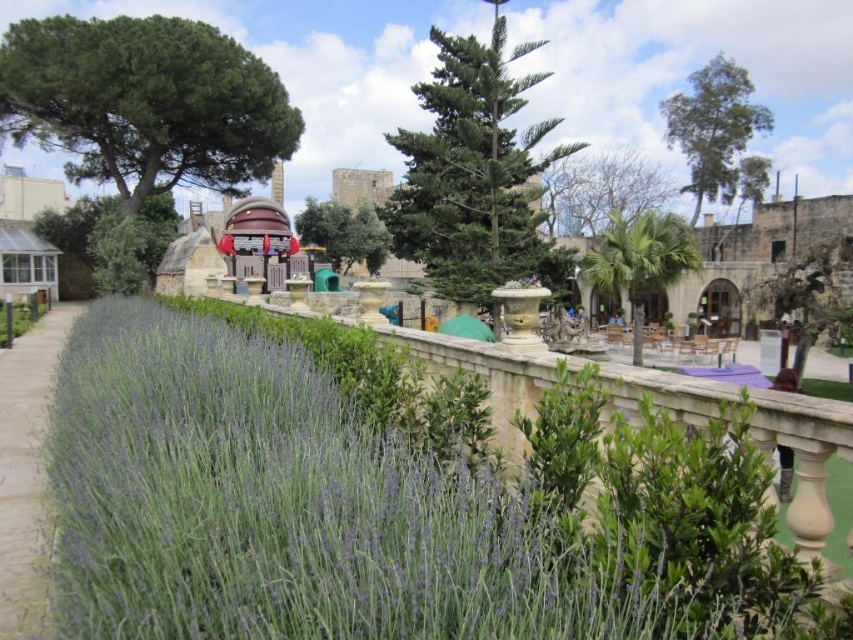
Question: Which of these objects is positioned farthest from the green leafy lavender at lower left?

Choices:
 (A) green leafy palm at center
 (B) green leafy tree at upper right
 (C) green textured tree at center

Answer: (B)

Question: Which point is closer to the camera?

Choices:
 (A) green leafy lavender at lower left
 (B) green grass at lower left
 (C) green leafy palm at center

Answer: (A)

Question: Is green textured tree at center positioned at the back of green leafy palm at center?

Choices:
 (A) no
 (B) yes

Answer: (B)

Question: Is green leafy tree at upper left bigger than green leafy tree at upper right?

Choices:
 (A) no
 (B) yes

Answer: (A)

Question: Can you confirm if green leafy tree at upper left is positioned below green leafy tree at upper center?

Choices:
 (A) no
 (B) yes

Answer: (A)

Question: Which object appears farthest from the camera in this image?

Choices:
 (A) green leafy palm at center
 (B) green leafy tree at upper right
 (C) green leafy tree at upper left

Answer: (B)